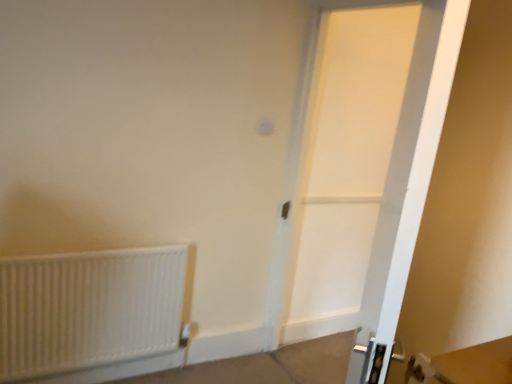
Question: In the image, is white matte radiator at lower left positioned in front of or behind white matte door at center?

Choices:
 (A) behind
 (B) front

Answer: (A)

Question: Is white matte radiator at lower left wider or thinner than white matte door at center?

Choices:
 (A) thin
 (B) wide

Answer: (A)

Question: Based on their sizes in the image, would you say white matte radiator at lower left is bigger or smaller than white matte door at center?

Choices:
 (A) small
 (B) big

Answer: (A)

Question: Considering their positions, is white matte door at center located in front of or behind white matte radiator at lower left?

Choices:
 (A) front
 (B) behind

Answer: (A)

Question: Considering the positions of white matte door at center and white matte radiator at lower left in the image, is white matte door at center taller or shorter than white matte radiator at lower left?

Choices:
 (A) tall
 (B) short

Answer: (A)

Question: From the image's perspective, is white matte door at center located above or below white matte radiator at lower left?

Choices:
 (A) below
 (B) above

Answer: (B)

Question: Does point (437, 41) appear closer or farther from the camera than point (82, 264)?

Choices:
 (A) closer
 (B) farther

Answer: (A)